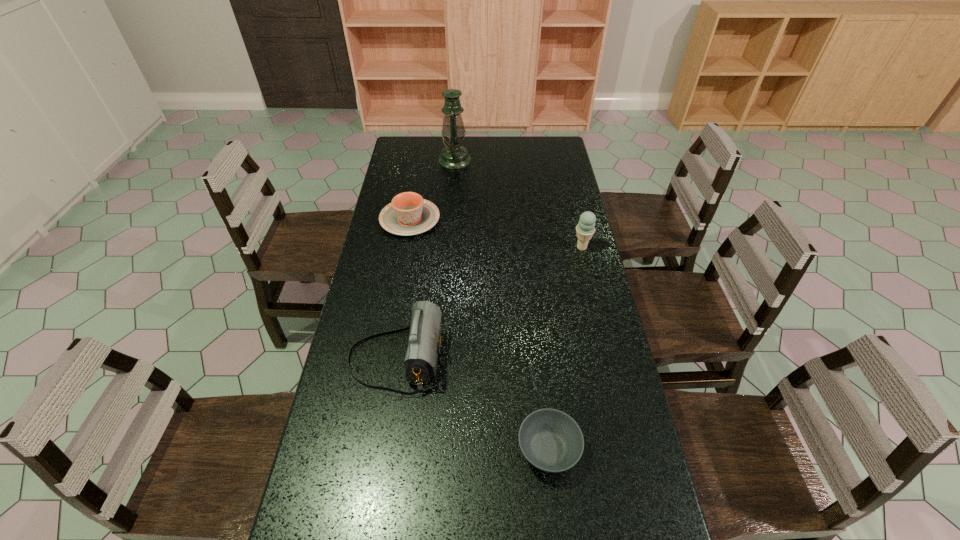
Where is `vacant region located 0.240m on the back of the second nearest object`? Image resolution: width=960 pixels, height=540 pixels. vacant region located 0.240m on the back of the second nearest object is located at coordinates (410, 269).

This screenshot has height=540, width=960. I want to click on blank space located 0.280m on the back of the rightmost object, so click(569, 195).

Where is `vacant space located 0.200m on the handle side of the second shortest object`? The height and width of the screenshot is (540, 960). vacant space located 0.200m on the handle side of the second shortest object is located at coordinates (418, 174).

I want to click on blank space located 0.130m on the handle side of the second shortest object, so click(x=417, y=183).

At what (x,y) coordinates should I click in order to perform the action: click on free space located on the handle side of the second shortest object. Please return your answer as a coordinate pair (x, y). The image size is (960, 540). Looking at the image, I should click on (422, 151).

At what (x,y) coordinates should I click in order to perform the action: click on free space located on the back of the soup bowl. Please return your answer as a coordinate pair (x, y). This screenshot has width=960, height=540. Looking at the image, I should click on (537, 339).

Locate an element on the screen. object that is at the far edge is located at coordinates (454, 156).

Where is `shoulder bag that is at the left edge`? The image size is (960, 540). shoulder bag that is at the left edge is located at coordinates (424, 342).

Locate an element on the screen. Image resolution: width=960 pixels, height=540 pixels. chinaware present at the left edge is located at coordinates (408, 214).

The image size is (960, 540). In order to click on ice cream situated at the right edge in this screenshot , I will do `click(585, 229)`.